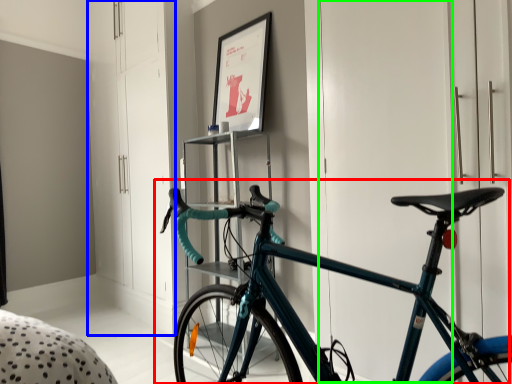
Question: Considering the real-world distances, which object is closest to bicycle (highlighted by a red box)? dresser (highlighted by a blue box) or door (highlighted by a green box).

Choices:
 (A) dresser
 (B) door

Answer: (B)